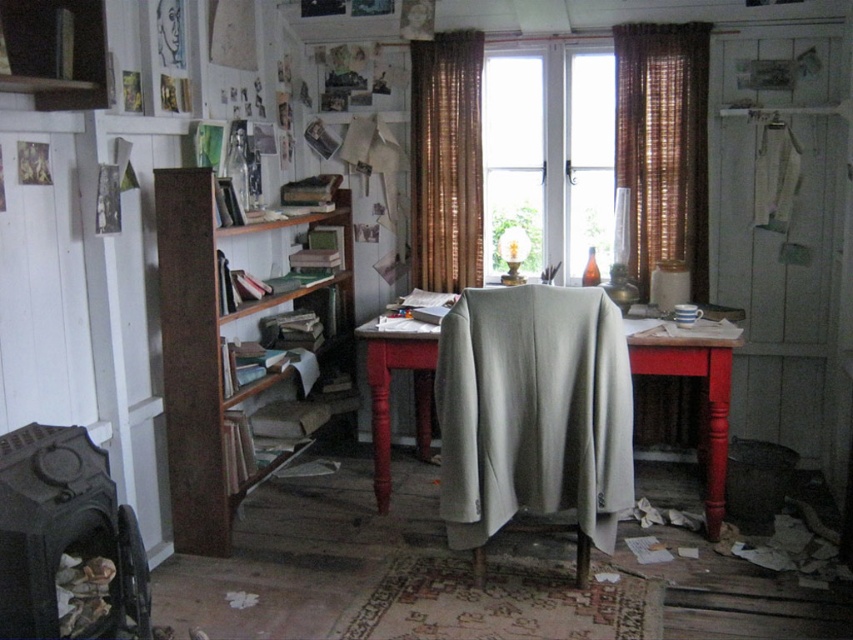
Question: Among these points, which one is farthest from the camera?

Choices:
 (A) (183, 428)
 (B) (578, 273)
 (C) (616, 140)

Answer: (B)

Question: Is brown wooden bookshelf at left below brown woven curtain at center?

Choices:
 (A) no
 (B) yes

Answer: (B)

Question: In this image, where is light gray fabric at center located relative to brown woven curtain at right?

Choices:
 (A) left
 (B) right

Answer: (A)

Question: Based on their relative distances, which object is nearer to the brown woven curtain at right?

Choices:
 (A) brown wooden bookshelf at left
 (B) smooth red wooden table at center

Answer: (B)

Question: Considering the relative positions of white glass window at center and brown woven curtain at right in the image provided, where is white glass window at center located with respect to brown woven curtain at right?

Choices:
 (A) left
 (B) right

Answer: (A)

Question: Which point is closer to the camera?

Choices:
 (A) brown woven curtain at right
 (B) smooth red wooden table at center
 (C) brown woven curtain at center

Answer: (B)